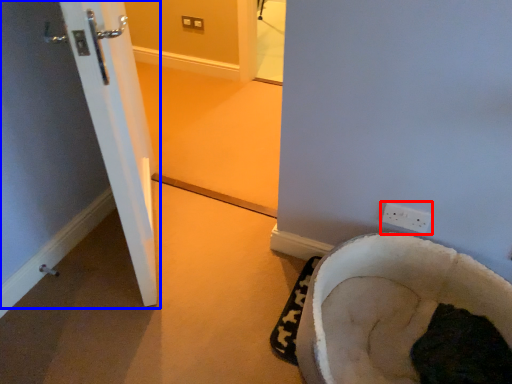
Question: Which of the following is the closest to the observer, electric outlet (highlighted by a red box) or door (highlighted by a blue box)?

Choices:
 (A) electric outlet
 (B) door

Answer: (A)